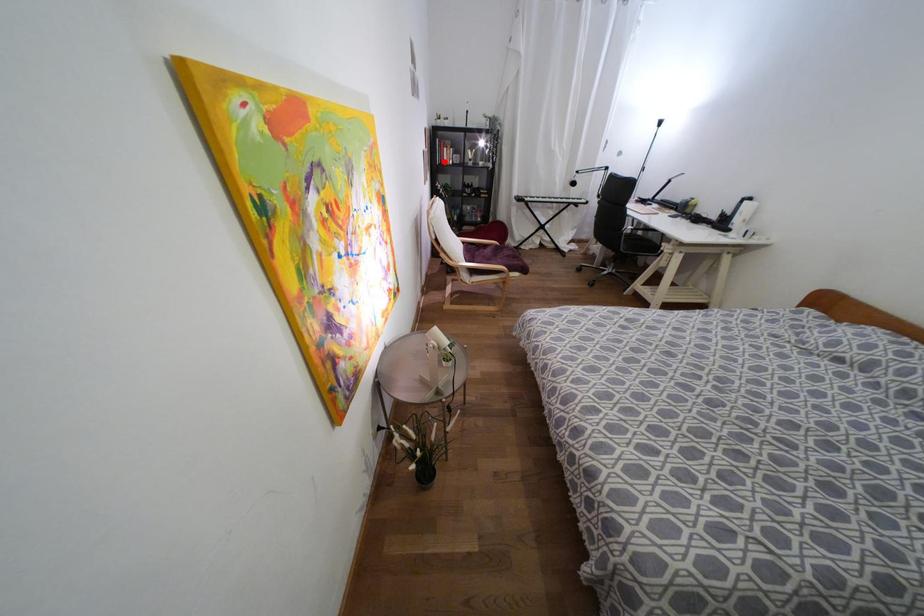
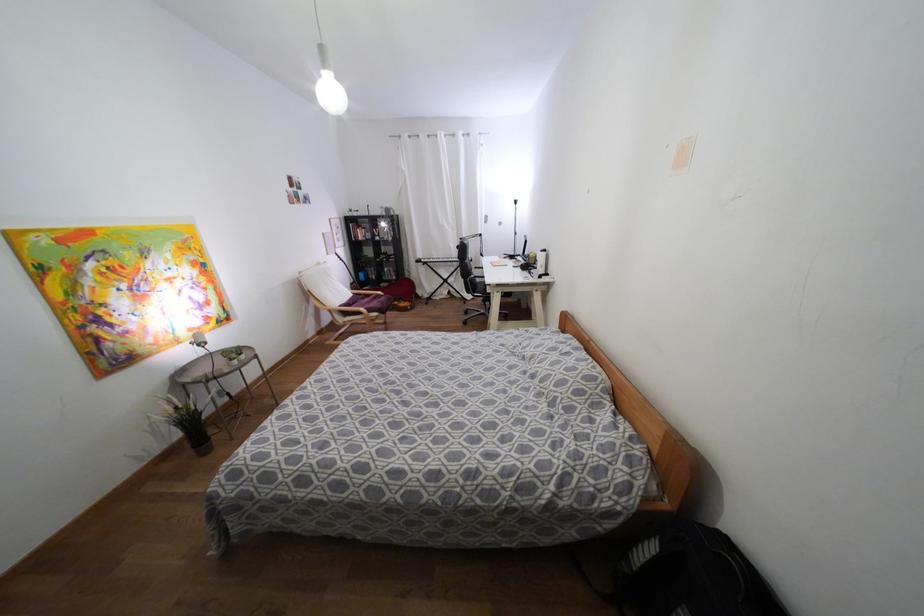
The point at the highlighted location is marked in the first image. Where is the corresponding point in the second image?

(359, 238)